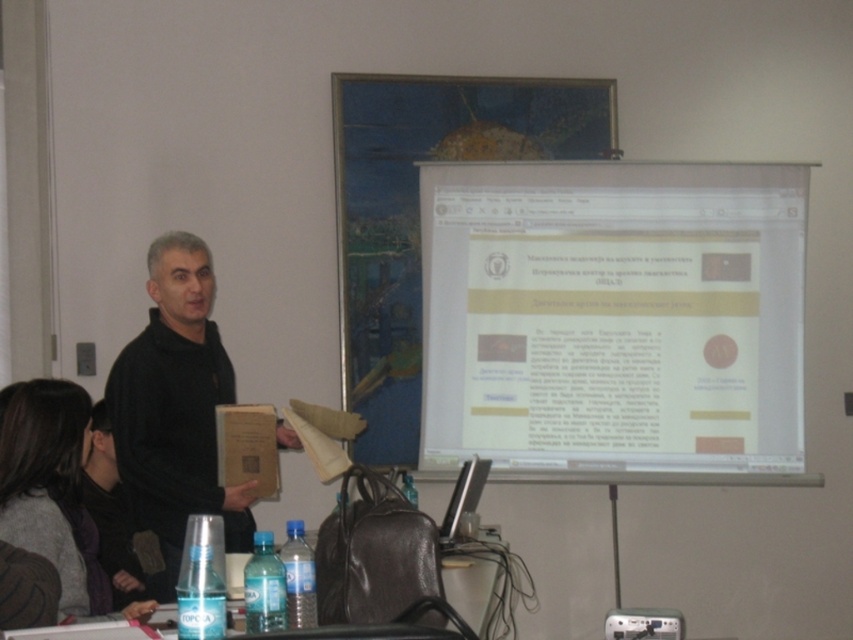
Is black matte sweater at center positioned behind translucent plastic table at lower center?

Yes, it is.

Who is higher up, black matte sweater at center or translucent plastic table at lower center?

black matte sweater at center

Does point (173, 582) come behind point (483, 541)?

No, (173, 582) is closer to viewer.

Where is `black matte sweater at center`? Image resolution: width=853 pixels, height=640 pixels. black matte sweater at center is located at coordinates (175, 408).

Does gray sweater at lower left have a greater height compared to translucent plastic table at lower center?

Yes.

Based on the photo, is gray sweater at lower left in front of translucent plastic table at lower center?

Yes, gray sweater at lower left is in front of translucent plastic table at lower center.

Is point (44, 404) positioned in front of point (236, 634)?

That is False.

You are a GUI agent. You are given a task and a screenshot of the screen. Output one action in this format:
    pyautogui.click(x=<x>, y=<y>)
    Task: Click on the gray sweater at lower left
    
    Given the screenshot: What is the action you would take?
    pyautogui.click(x=55, y=493)

Measure the distance between black matte sweater at center and gray sweater at lower left.

21.02 inches

Identify the location of black matte sweater at center. This screenshot has width=853, height=640. (175, 408).